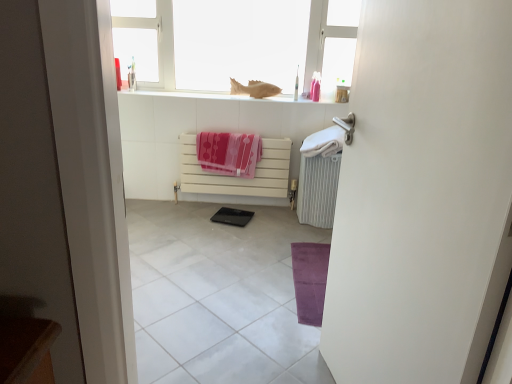
This screenshot has width=512, height=384. I want to click on vacant space behind purple velvety yoga mat at lower right, so click(275, 231).